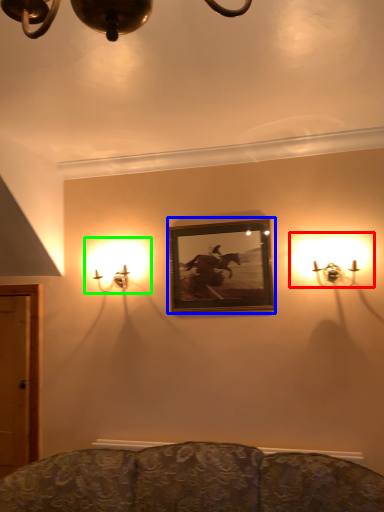
Question: Estimate the real-world distances between objects in this image. Which object is farther from lamp (highlighted by a red box), picture frame (highlighted by a blue box) or lamp (highlighted by a green box)?

Choices:
 (A) picture frame
 (B) lamp

Answer: (B)